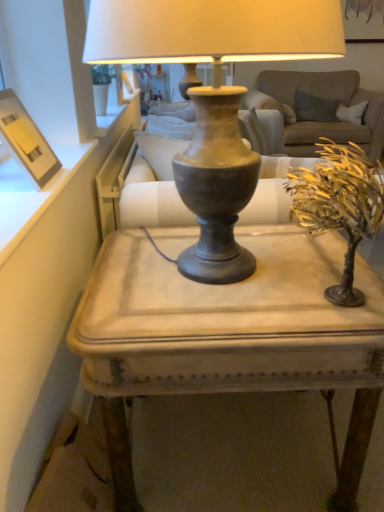
Locate an element on the screen. vacant location below matte wood picture frame at upper left (from a real-world perspective) is located at coordinates (19, 187).